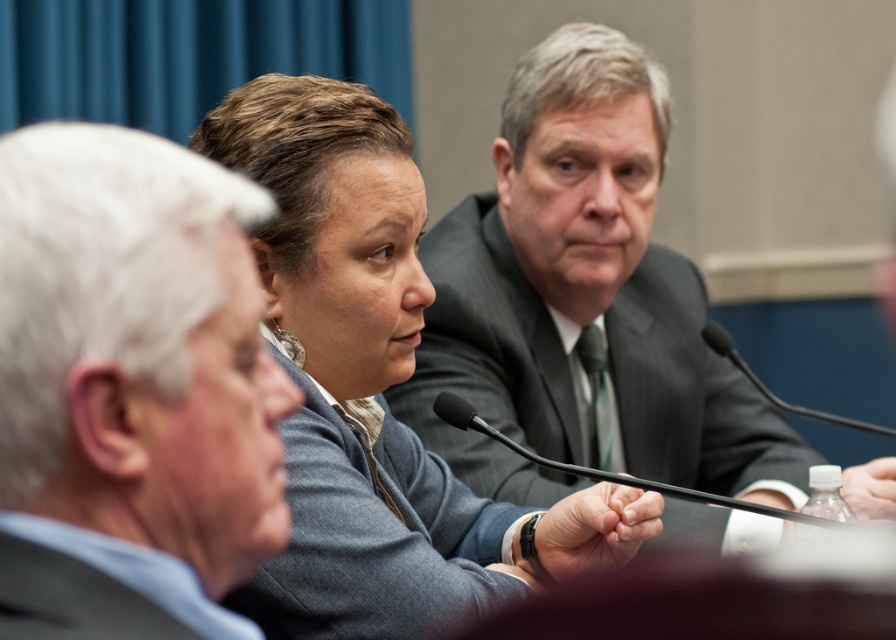
Does matte gray sweater at center have a smaller size compared to white cotton shirt at lower left?

Incorrect, matte gray sweater at center is not smaller in size than white cotton shirt at lower left.

Identify the location of matte gray sweater at center. This screenshot has height=640, width=896. (375, 388).

Does point (319, 586) come behind point (168, 628)?

Yes, it is behind point (168, 628).

Where is `matte gray sweater at center`? matte gray sweater at center is located at coordinates [375, 388].

Does matte gray sweater at center come in front of dark gray textured suit at center?

That is False.

Who is shorter, matte gray sweater at center or dark gray textured suit at center?

dark gray textured suit at center

Is point (438, 522) farther from camera compared to point (397, 525)?

Yes, it is behind point (397, 525).

You are a GUI agent. You are given a task and a screenshot of the screen. Output one action in this format:
    pyautogui.click(x=<x>, y=<y>)
    Task: Click on the matte gray sweater at center
    The image size is (896, 640).
    Given the screenshot: What is the action you would take?
    pyautogui.click(x=375, y=388)

In the scene shown: Does dark gray suit at center appear on the right side of matte gray sweater at center?

Correct, you'll find dark gray suit at center to the right of matte gray sweater at center.

Does dark gray suit at center have a smaller size compared to matte gray sweater at center?

No.

What do you see at coordinates (584, 301) in the screenshot? I see `dark gray suit at center` at bounding box center [584, 301].

The height and width of the screenshot is (640, 896). Find the location of `dark gray suit at center`. dark gray suit at center is located at coordinates (584, 301).